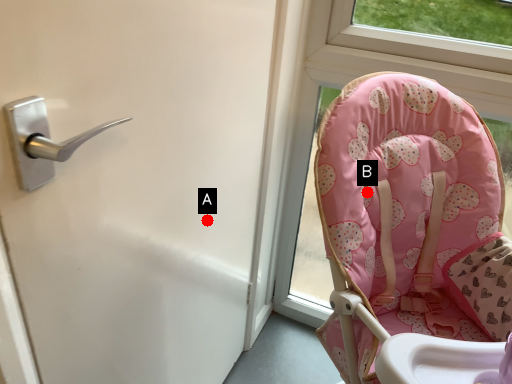
Question: Two points are circled on the image, labeled by A and B beside each circle. Which point is farther to the camera?

Choices:
 (A) A is further
 (B) B is further

Answer: (A)